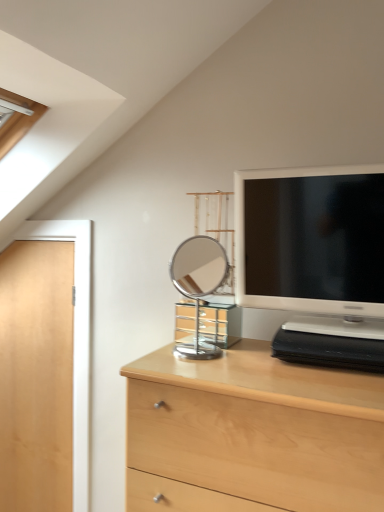
You are a GUI agent. You are given a task and a screenshot of the screen. Output one action in this format:
    pyautogui.click(x=<x>, y=<y>)
    Task: Click on the free space above light wood chest of drawers at center (from a real-world perspective)
    This screenshot has height=512, width=384.
    Given the screenshot: What is the action you would take?
    pyautogui.click(x=241, y=357)